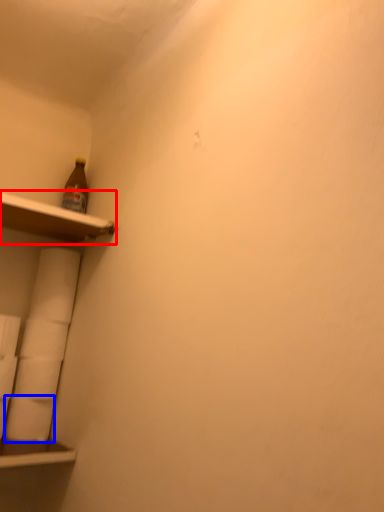
Question: Which of the following is the farthest to the observer, shelf (highlighted by a red box) or toilet paper (highlighted by a blue box)?

Choices:
 (A) shelf
 (B) toilet paper

Answer: (B)